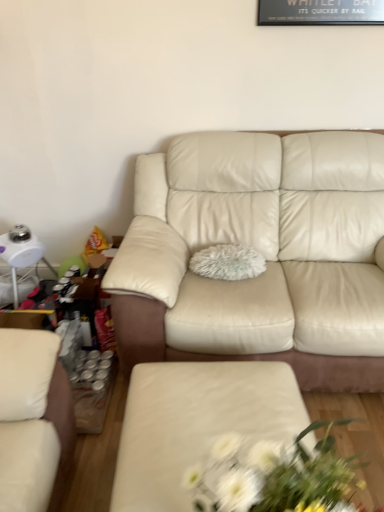
Question: Are cream leather couch at center and matte cream ottoman at center far apart?

Choices:
 (A) yes
 (B) no

Answer: (B)

Question: Is matte cream ottoman at center at the back of cream leather couch at center?

Choices:
 (A) yes
 (B) no

Answer: (B)

Question: Is cream leather couch at center smaller than matte cream ottoman at center?

Choices:
 (A) yes
 (B) no

Answer: (B)

Question: From the image's perspective, would you say cream leather couch at center is shown under matte cream ottoman at center?

Choices:
 (A) no
 (B) yes

Answer: (A)

Question: Can you confirm if cream leather couch at center is thinner than matte cream ottoman at center?

Choices:
 (A) yes
 (B) no

Answer: (B)

Question: Is point (206, 437) positioned closer to the camera than point (283, 471)?

Choices:
 (A) closer
 (B) farther

Answer: (B)

Question: In terms of size, does matte cream ottoman at center appear bigger or smaller than white fabric floral arrangement at center?

Choices:
 (A) big
 (B) small

Answer: (A)

Question: Do you think matte cream ottoman at center is within white fabric floral arrangement at center, or outside of it?

Choices:
 (A) inside
 (B) outside

Answer: (B)

Question: From the image's perspective, relative to white fabric floral arrangement at center, is matte cream ottoman at center above or below?

Choices:
 (A) above
 (B) below

Answer: (B)

Question: In terms of height, does matte cream ottoman at center look taller or shorter compared to fluffy white pillow at center?

Choices:
 (A) tall
 (B) short

Answer: (A)

Question: Choose the correct answer: Is matte cream ottoman at center inside fluffy white pillow at center or outside it?

Choices:
 (A) inside
 (B) outside

Answer: (B)

Question: Visually, is matte cream ottoman at center positioned to the left or to the right of fluffy white pillow at center?

Choices:
 (A) left
 (B) right

Answer: (A)

Question: Looking at their shapes, would you say matte cream ottoman at center is wider or thinner than fluffy white pillow at center?

Choices:
 (A) thin
 (B) wide

Answer: (B)

Question: Is cream leather couch at center in front of or behind matte cream ottoman at center in the image?

Choices:
 (A) front
 (B) behind

Answer: (B)

Question: Is point (321, 294) positioned closer to the camera than point (155, 494)?

Choices:
 (A) closer
 (B) farther

Answer: (B)